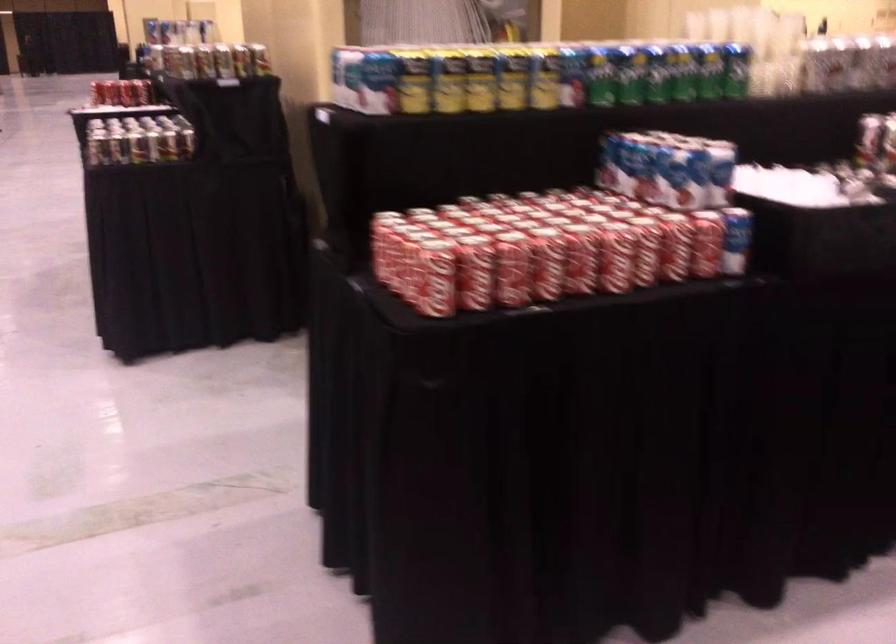
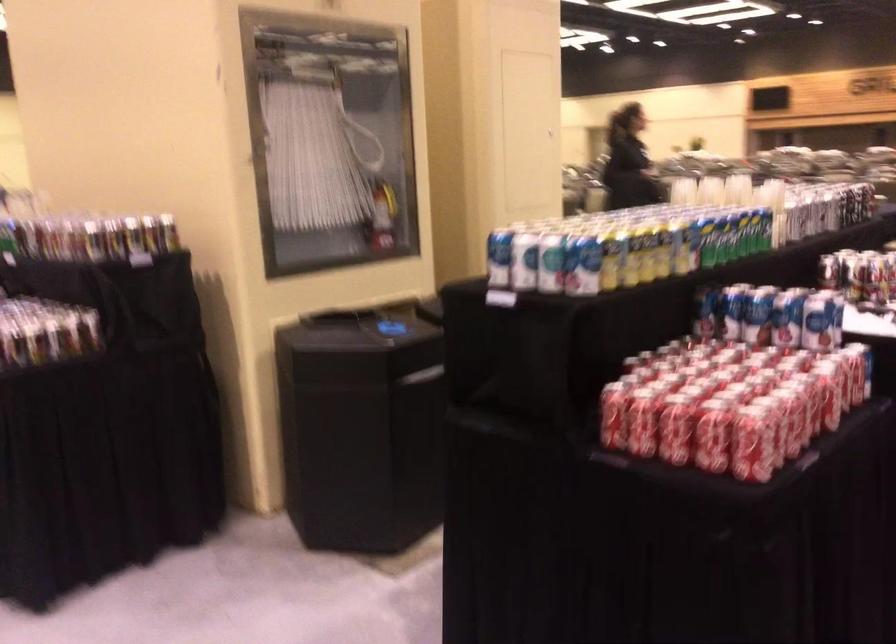
Where in the second image is the point corresponding to pixel 375 249 from the first image?

(642, 422)